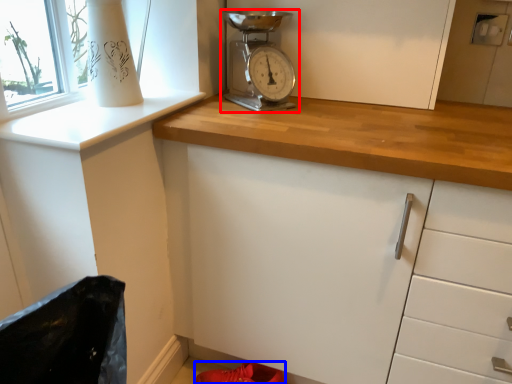
Question: Which point is closer to the camera, home appliance (highlighted by a red box) or footwear (highlighted by a blue box)?

Choices:
 (A) home appliance
 (B) footwear

Answer: (A)